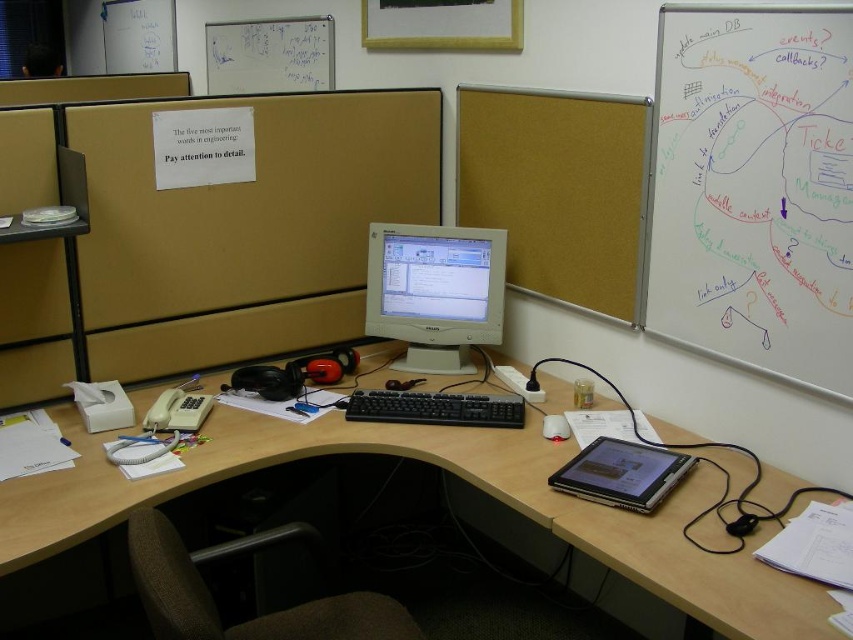
Between black plastic computer desk at center and brown felt at upper right, which one is positioned lower?

black plastic computer desk at center is below.

Who is more distant from viewer, (679, 552) or (537, 259)?

Positioned behind is point (537, 259).

Find the location of a particular element. The image size is (853, 640). black plastic computer desk at center is located at coordinates (448, 472).

Does brown felt at upper right have a larger size compared to white matte mouse at center?

Indeed, brown felt at upper right has a larger size compared to white matte mouse at center.

Is brown felt at upper right wider than white matte mouse at center?

Yes, brown felt at upper right is wider than white matte mouse at center.

This screenshot has width=853, height=640. Describe the element at coordinates (558, 189) in the screenshot. I see `brown felt at upper right` at that location.

Where is `brown felt at upper right`? brown felt at upper right is located at coordinates (558, 189).

Who is positioned more to the right, black plastic keyboard at center or white matte mouse at center?

white matte mouse at center is more to the right.

In order to click on black plastic keyboard at center in this screenshot , I will do `click(434, 408)`.

Where is `black plastic keyboard at center`? The height and width of the screenshot is (640, 853). black plastic keyboard at center is located at coordinates (434, 408).